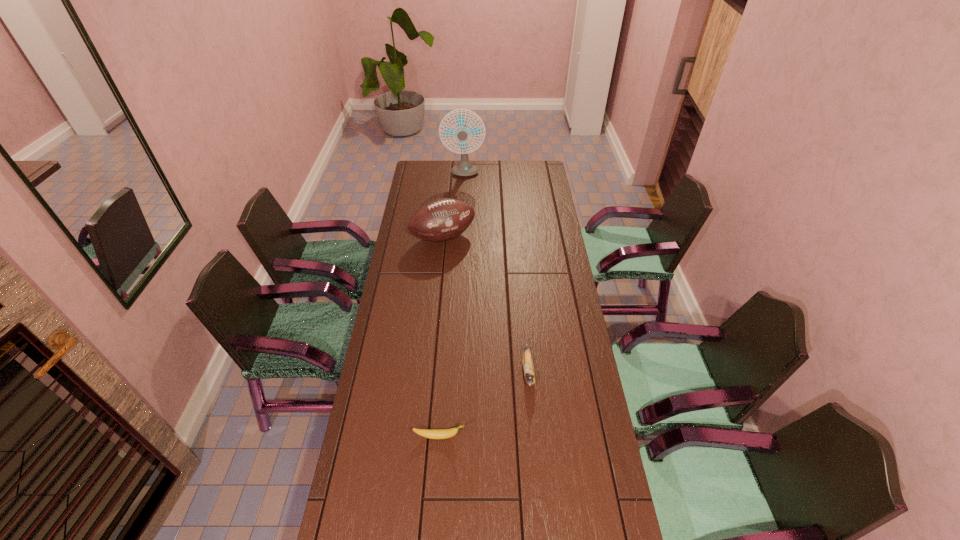
Locate an element on the screen. The height and width of the screenshot is (540, 960). free point that satisfies the following two spatial constraints: 1. on the front-facing side of the farthest object; 2. at the stem of the shorter banana is located at coordinates (450, 436).